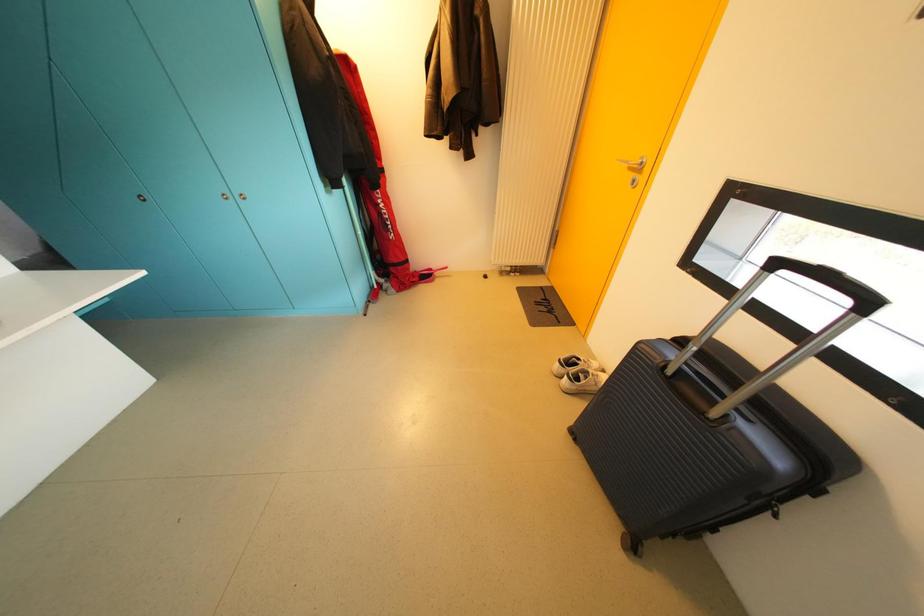
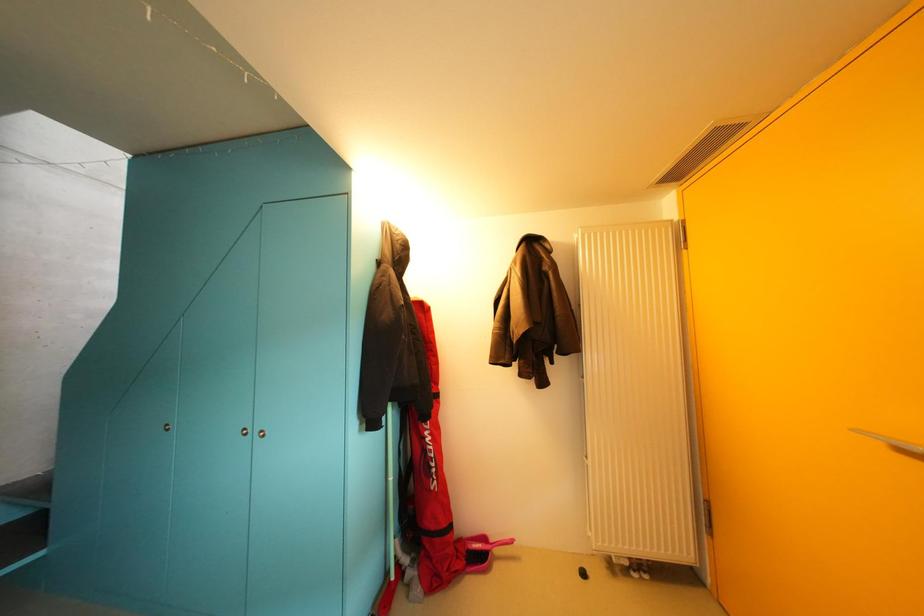
How did the camera likely rotate?

The rotation direction of the camera is left-up.